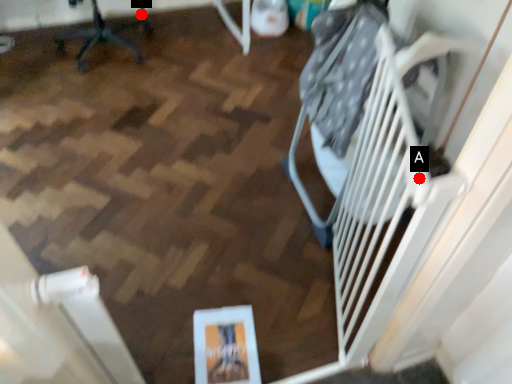
Question: Two points are circled on the image, labeled by A and B beside each circle. Which of the following is the farthest from the observer?

Choices:
 (A) A is further
 (B) B is further

Answer: (B)